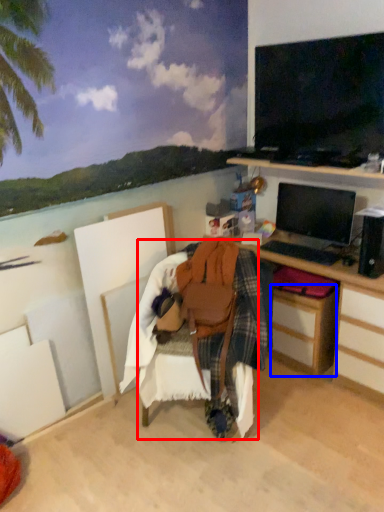
Question: Among these objects, which one is nearest to the camera, chair (highlighted by a red box) or drawer (highlighted by a blue box)?

Choices:
 (A) chair
 (B) drawer

Answer: (A)